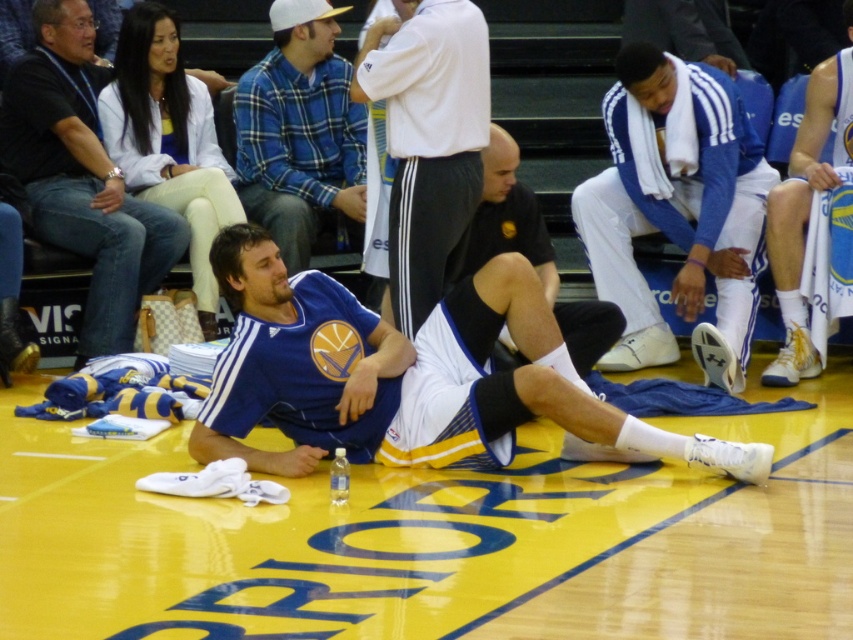
What do you see at coordinates (428, 141) in the screenshot? I see `white fleece jacket at center` at bounding box center [428, 141].

Consider the image. Who is more forward, (467, 141) or (572, 355)?

Point (467, 141) is in front.

Find the location of a particular element. This screenshot has width=853, height=640. white fleece jacket at center is located at coordinates (428, 141).

Based on the photo, can you confirm if blue jersey at center is wider than black matte shorts at center?

Correct, the width of blue jersey at center exceeds that of black matte shorts at center.

Between blue jersey at center and black matte shorts at center, which one appears on the left side from the viewer's perspective?

blue jersey at center

Between point (474, 280) and point (489, 218), which one is positioned in front?

Point (474, 280) is in front.

Find the location of a particular element. blue jersey at center is located at coordinates (407, 376).

Based on the photo, who is positioned more to the right, white jersey at right or black matte shorts at center?

white jersey at right is more to the right.

Is white jersey at right thinner than black matte shorts at center?

Correct, white jersey at right's width is less than black matte shorts at center's.

Measure the distance between white jersey at right and camera.

The distance of white jersey at right from camera is 10.94 meters.

This screenshot has height=640, width=853. In order to click on white jersey at right in this screenshot , I will do `click(805, 209)`.